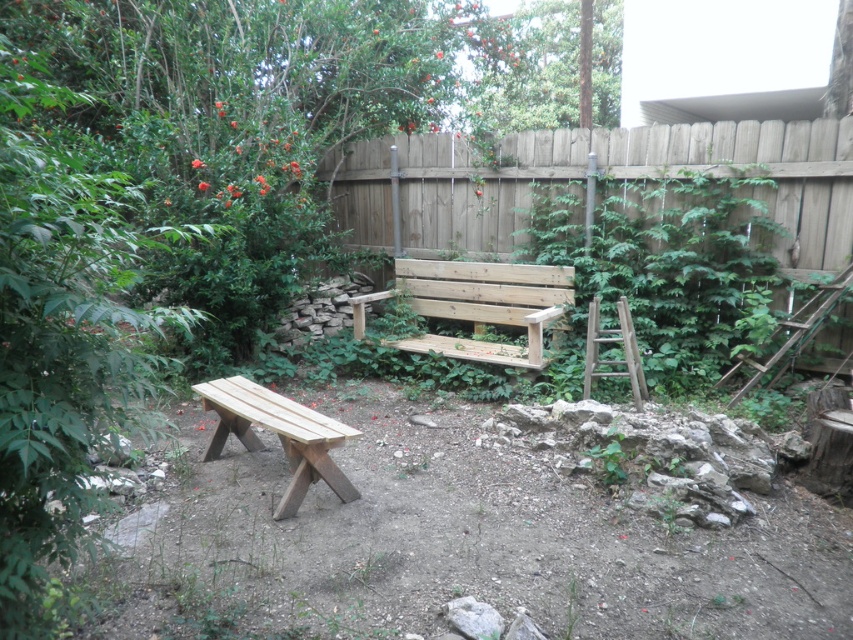
You are planning to set up a picnic in this backyard. You have a picnic blanket that is 6 feet long. You want to place it between the wooden bench at center and the natural wood bench at lower left so that both benches are on the edges of the blanket. Is this possible?

The wooden bench at center and natural wood bench at lower left are 7.23 feet apart from each other. Since the picnic blanket is only 6 feet long, it is not long enough to cover the distance between them. Therefore, you cannot place the blanket between the two benches with both on the edges.

You are standing at the wooden bench at center. You want to walk to the wooden swing bench at center right. How many steps would you need to take if each step covers 0.75 meters?

The distance between the wooden bench at center and the wooden swing bench at center right is 5.05 meters. Dividing the distance by the step length of 0.75 meters gives approximately 6.73 steps. Since you can only take whole steps, you would need to take 7 steps to reach the wooden swing bench at center right.

You are standing at the entrance of the backyard and want to sit on the wooden bench at center. According to the coordinates provided, in which direction should you walk to reach it?

The wooden bench at center is located at coordinates point (477, 305). Since the coordinate system typically places the origin at the bottom left corner, moving towards higher x values moves right and higher y values move upward. To reach the bench from the entrance, you should walk towards the center area of the backyard, slightly to the right and forward.